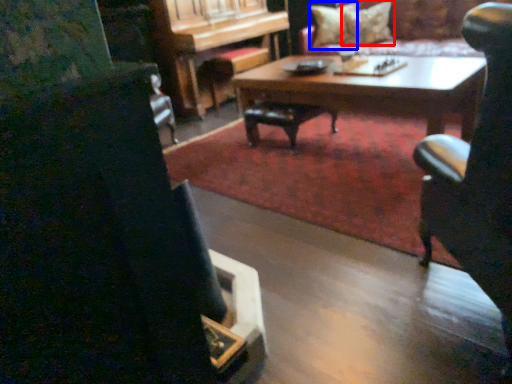
Question: Which object appears closest to the camera in this image, pillow (highlighted by a red box) or pillow (highlighted by a blue box)?

Choices:
 (A) pillow
 (B) pillow

Answer: (A)